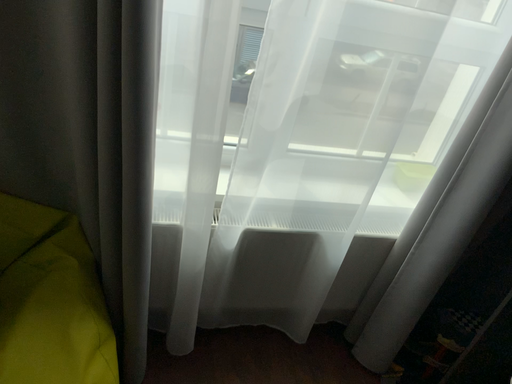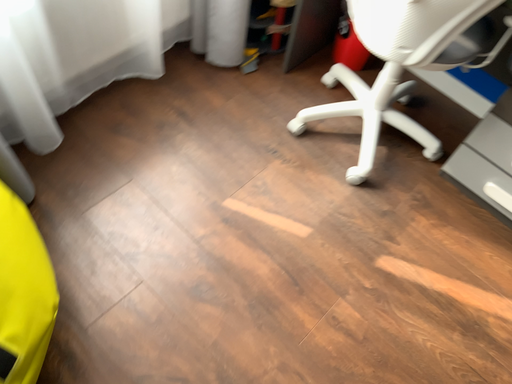
Question: How did the camera likely rotate when shooting the video?

Choices:
 (A) rotated upward
 (B) rotated downward

Answer: (B)